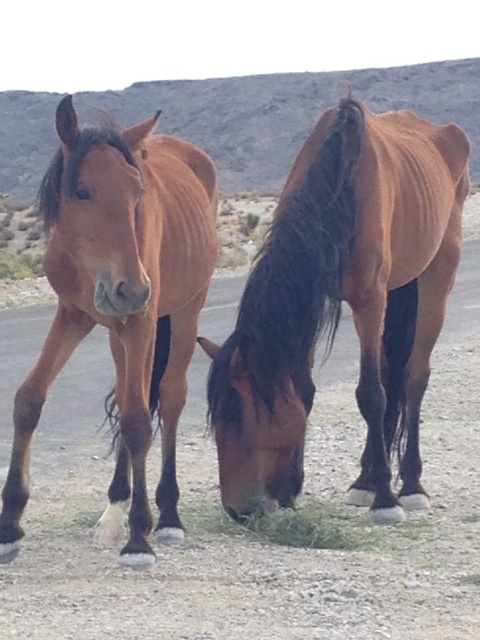
Is brown glossy horse at center to the right of green grass at lower center from the viewer's perspective?

Indeed, brown glossy horse at center is positioned on the right side of green grass at lower center.

Who is more distant from viewer, (276, 253) or (358, 518)?

The point (358, 518) is more distant.

What are the coordinates of `brown glossy horse at center` in the screenshot? It's located at [339, 305].

Find the location of `brown glossy horse at left`. brown glossy horse at left is located at coordinates (121, 304).

Is point (175, 516) positioned in front of point (230, 524)?

Yes, point (175, 516) is closer to viewer.

Image resolution: width=480 pixels, height=640 pixels. What are the coordinates of `brown glossy horse at left` in the screenshot? It's located at (121, 304).

The width and height of the screenshot is (480, 640). What do you see at coordinates (339, 305) in the screenshot?
I see `brown glossy horse at center` at bounding box center [339, 305].

Is brown glossy horse at center below brown glossy horse at left?

Yes, brown glossy horse at center is below brown glossy horse at left.

This screenshot has width=480, height=640. I want to click on brown glossy horse at center, so click(x=339, y=305).

Where is `brown glossy horse at center`? The image size is (480, 640). brown glossy horse at center is located at coordinates (339, 305).